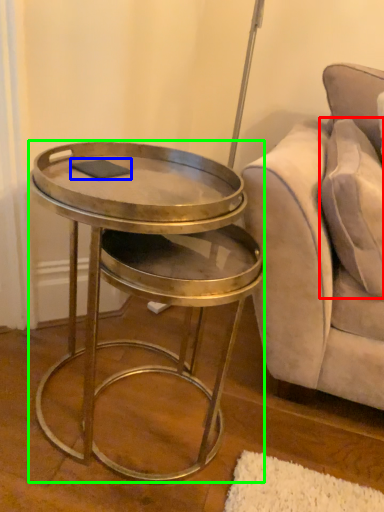
Question: Considering the real-world distances, which object is farthest from pillow (highlighted by a red box)? pad (highlighted by a blue box) or table (highlighted by a green box)?

Choices:
 (A) pad
 (B) table

Answer: (A)